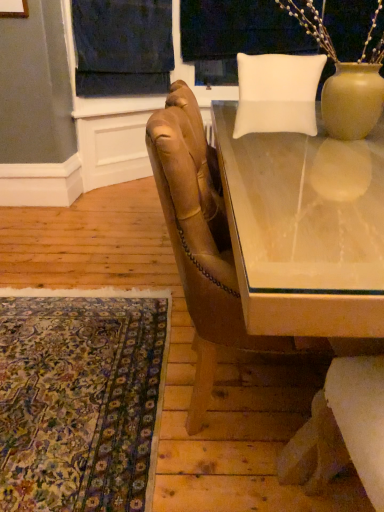
I want to click on vacant space situated above carpet with intricate patterns at lower left (from a real-world perspective), so 69,365.